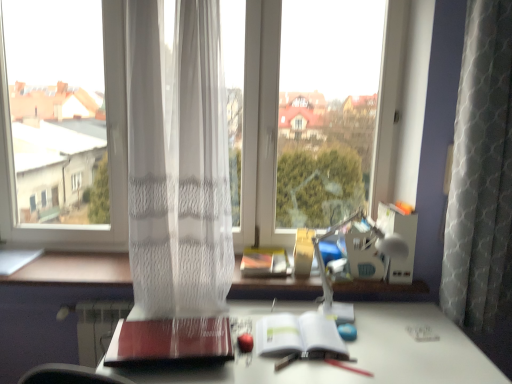
I want to click on vacant area that is in front of white paper at center, which is counted as the 1th paperback book, starting from the right, so [x=305, y=372].